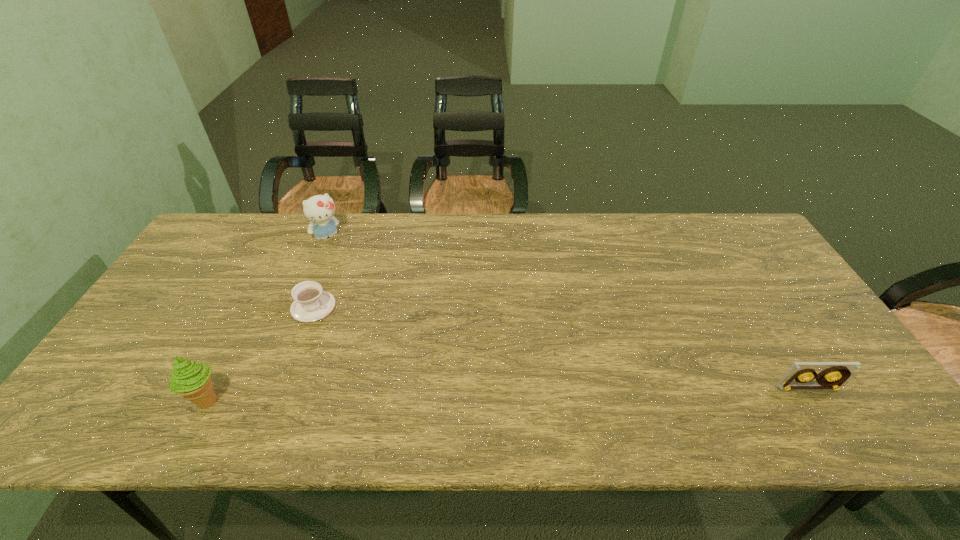
In the image, there is a desktop. At what (x,y) coordinates should I click in order to perform the action: click on vacant space at the near left corner. Please return your answer as a coordinate pair (x, y). This screenshot has height=540, width=960. Looking at the image, I should click on (132, 396).

What are the coordinates of `vacant area at the far right corner` in the screenshot? It's located at (732, 239).

The width and height of the screenshot is (960, 540). Identify the location of empty location between the icecream and the second shortest object. (508, 394).

The height and width of the screenshot is (540, 960). I want to click on free space that is in between the second shortest object and the icecream, so click(x=508, y=394).

Where is `unoccupied area between the farthest object and the videotape`? unoccupied area between the farthest object and the videotape is located at coordinates (568, 313).

You are a GUI agent. You are given a task and a screenshot of the screen. Output one action in this format:
    pyautogui.click(x=<x>, y=<y>)
    Task: Click on the free space between the farthest object and the teacup
    The height and width of the screenshot is (540, 960).
    Given the screenshot: What is the action you would take?
    pyautogui.click(x=321, y=272)

Find the location of `blank region between the teacup and the kitten`. blank region between the teacup and the kitten is located at coordinates (321, 272).

Image resolution: width=960 pixels, height=540 pixels. In order to click on vacant area that lies between the teacup and the videotape in this screenshot , I will do `click(561, 347)`.

Image resolution: width=960 pixels, height=540 pixels. Find the location of `free space between the third nearest object and the farthest object`. free space between the third nearest object and the farthest object is located at coordinates (x=321, y=272).

The width and height of the screenshot is (960, 540). Identify the location of vacant region between the second farthest object and the farthest object. (321, 272).